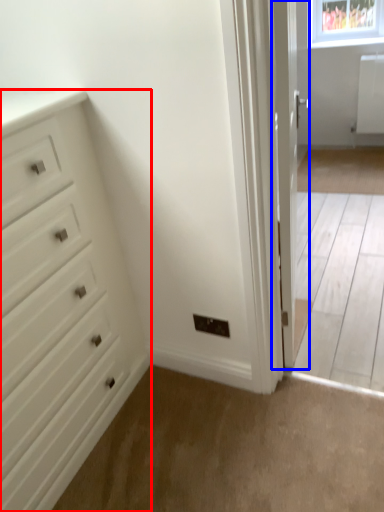
Question: Which point is closer to the camera, chest of drawers (highlighted by a red box) or door (highlighted by a blue box)?

Choices:
 (A) chest of drawers
 (B) door

Answer: (A)